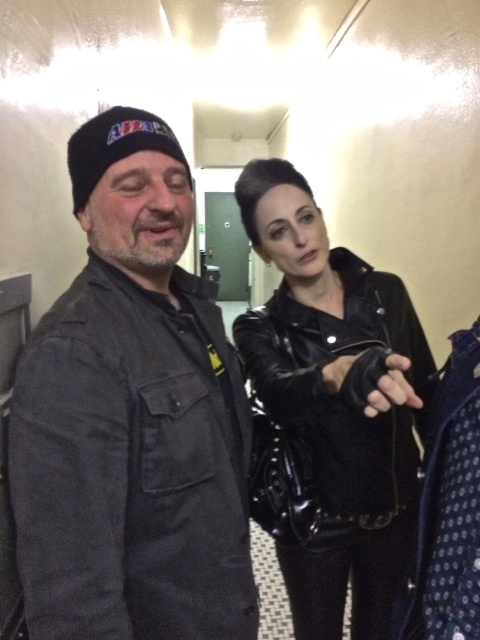
Consider the image. You are a photographer standing in front of the dark gray denim jacket at left. You want to take a closeup shot of the jacket without moving your position. Is your current distance sufficient to capture the jacket in detail?

The dark gray denim jacket at left and viewer are 65.01 centimeters apart from each other, which is sufficient for a closeup shot without needing to move closer.

You are a photographer setting up a shoot in the described scene. You need to position a backdrop that must be placed behind both the dark gray denim jacket at left and the black leather jacket at center. Given their spatial relationship, which jacket should the backdrop be placed closer to?

The backdrop should be placed closer to the black leather jacket at center because the dark gray denim jacket at left occupies less space, meaning the black leather jacket at center requires more coverage area.

You are a photographer setting up for a photoshoot in a backstage area. You need to place a tripod at point coordinates of 0.6, 0.25. Is the dark gray denim jacket at left in your way?

The dark gray denim jacket at left is located at point coordinates of (132,417), which is very close to the desired tripod placement at (120,384). The jacket is likely in the way and should be moved to avoid obstruction.